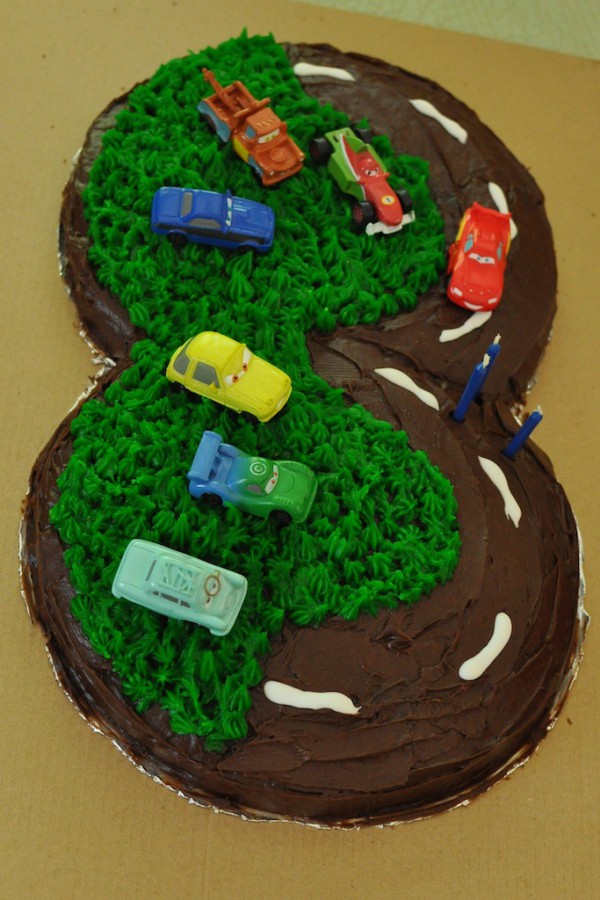
I want to click on blue candles, so click(525, 428), click(471, 391), click(493, 349).